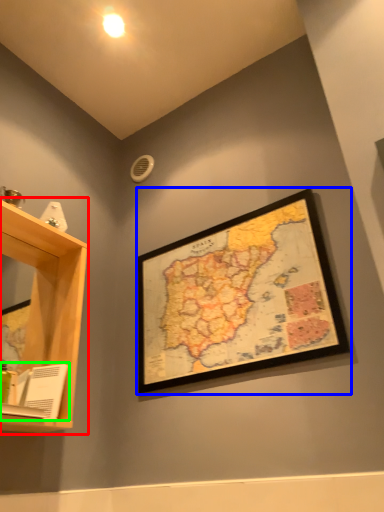
Question: Based on their relative distances, which object is nearer to shelf (highlighted by a red box)? Choose from picture frame (highlighted by a blue box) and book (highlighted by a green box).

Choices:
 (A) picture frame
 (B) book

Answer: (B)